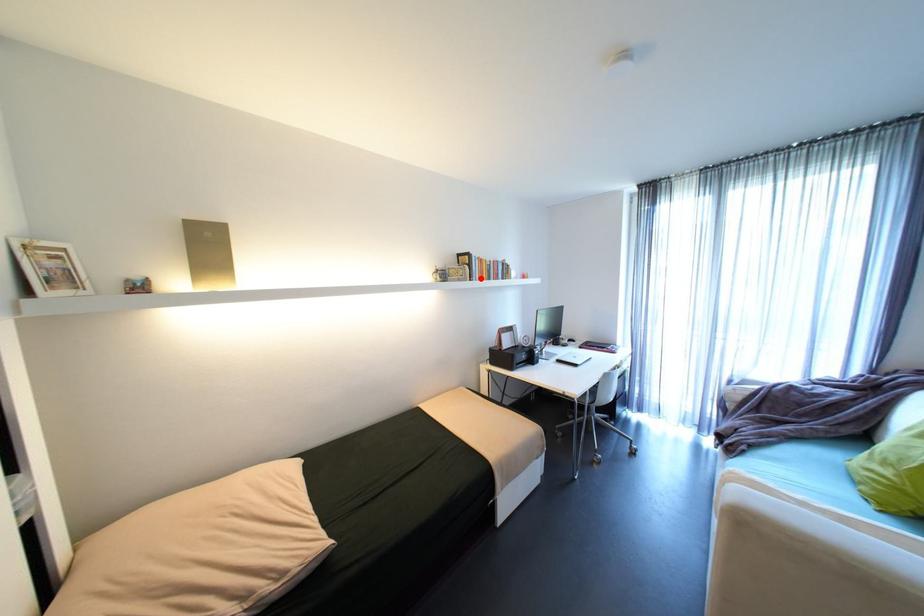
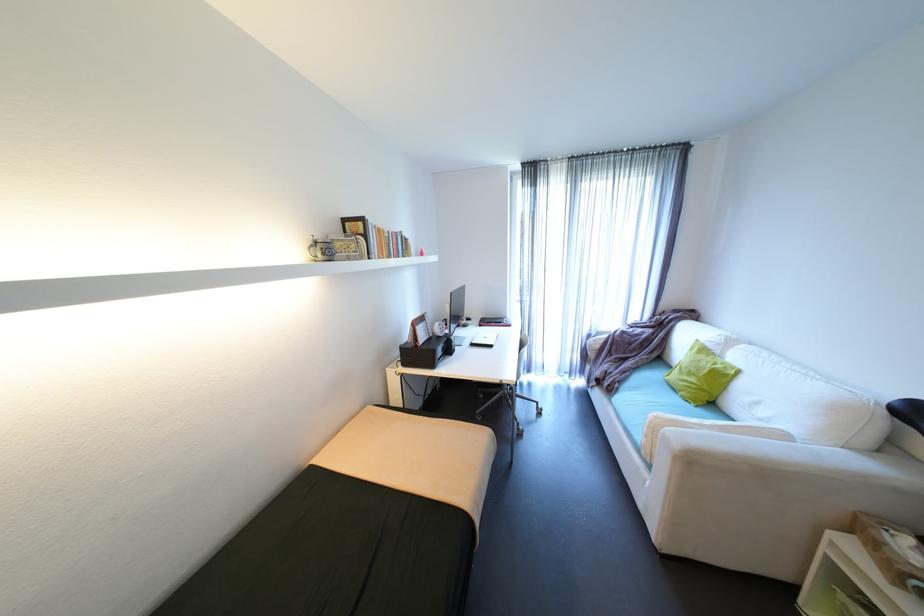
The point at the highlighted location is marked in the first image. Where is the corresponding point in the second image?

(380, 254)